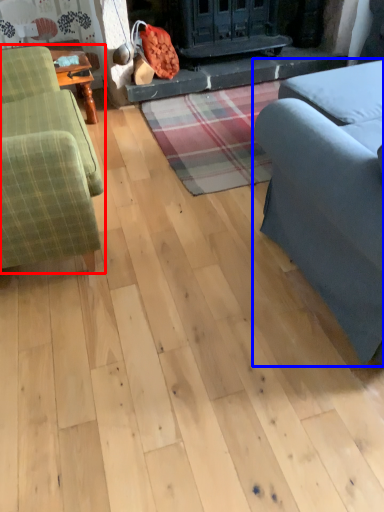
Question: Which object appears farthest to the camera in this image, studio couch (highlighted by a red box) or studio couch (highlighted by a blue box)?

Choices:
 (A) studio couch
 (B) studio couch

Answer: (A)